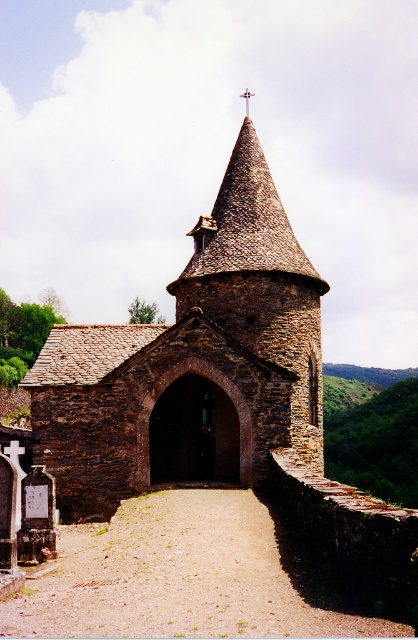
Consider the image. You are standing in front of the rustic stone church at center and looking up towards the metallic cross at upper center. Which object is more to the right side?

The metallic cross at upper center is more to the right side because the rustic stone church at center is positioned on the left side of it.

You are standing at the point labeled point [193,364] in the image of the quaint stone church. Based on the scene description, which object are you closest to?

You are closest to the rustic stone church at center, as the point [193,364] corresponds to that object according to the description.